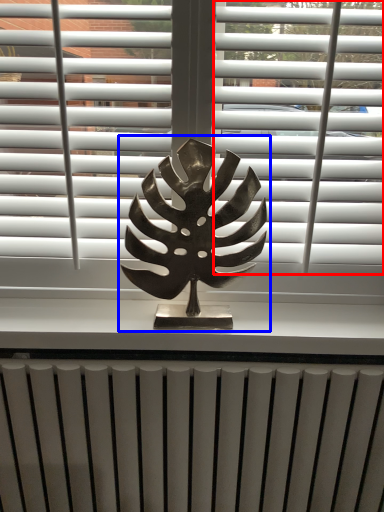
Question: Which object appears farthest to the camera in this image, blind (highlighted by a red box) or bronze statue (highlighted by a blue box)?

Choices:
 (A) blind
 (B) bronze statue

Answer: (A)